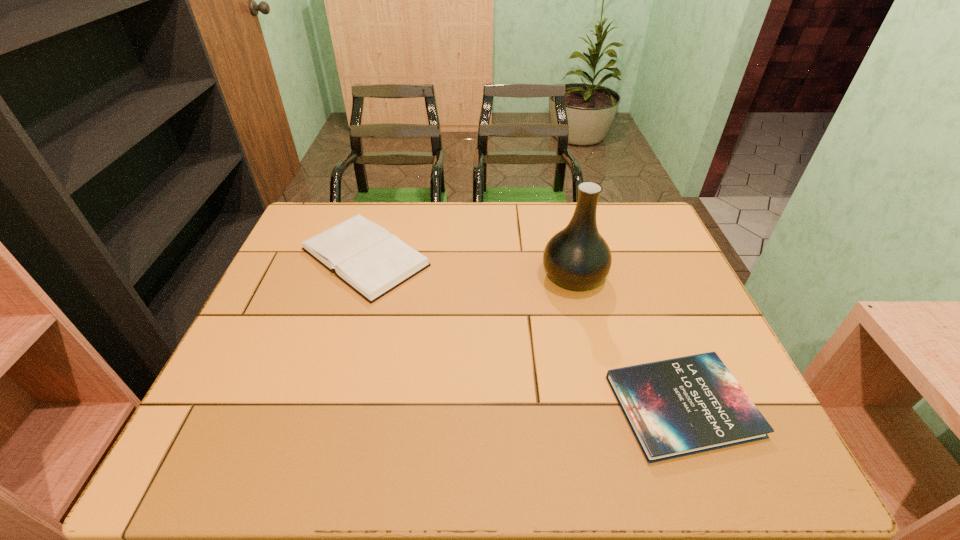
This screenshot has height=540, width=960. What are the coordinates of `the tallest object` in the screenshot? It's located at (577, 257).

At what (x,y) coordinates should I click in order to perform the action: click on the farther hardback book. Please return your answer as a coordinate pair (x, y). This screenshot has width=960, height=540. Looking at the image, I should click on (364, 255).

The image size is (960, 540). In order to click on the taller hardback book in this screenshot , I will do `click(364, 255)`.

Find the location of a particular element. Image resolution: width=960 pixels, height=540 pixels. the shorter hardback book is located at coordinates (682, 406).

Identify the location of the nearer hardback book. The height and width of the screenshot is (540, 960). (682, 406).

Where is `vacant region located on the front of the tallest object`? vacant region located on the front of the tallest object is located at coordinates (x=590, y=346).

The width and height of the screenshot is (960, 540). In order to click on free space located 0.280m on the front of the taller hardback book in this screenshot , I will do `click(323, 397)`.

Where is `free space located 0.070m on the left of the shorter hardback book`? This screenshot has height=540, width=960. free space located 0.070m on the left of the shorter hardback book is located at coordinates (580, 406).

Identify the location of object located at the far edge. The image size is (960, 540). (364, 255).

The width and height of the screenshot is (960, 540). What are the coordinates of `object that is positioned at the near edge` in the screenshot? It's located at (682, 406).